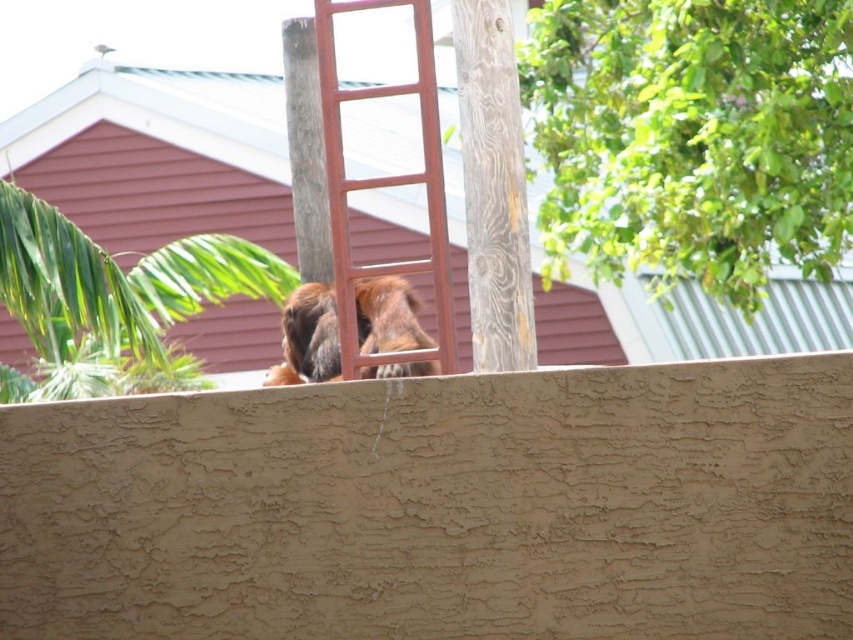
Question: Considering the real-world distances, which object is farthest from the weathered wood pole at center?

Choices:
 (A) green leafy tree at upper right
 (B) brown wooden ladder at center

Answer: (A)

Question: Can you confirm if green leafy tree at upper left is wider than brown furry dog at center?

Choices:
 (A) no
 (B) yes

Answer: (A)

Question: Can you confirm if green leafy tree at upper right is bigger than brown furry dog at center?

Choices:
 (A) yes
 (B) no

Answer: (A)

Question: Is green leafy tree at upper right to the right of brown furry dog at center from the viewer's perspective?

Choices:
 (A) yes
 (B) no

Answer: (A)

Question: Estimate the real-world distances between objects in this image. Which object is closer to the weathered wood pole at center?

Choices:
 (A) green leafy tree at upper left
 (B) green leafy tree at upper right

Answer: (A)

Question: Which point is closer to the camera?

Choices:
 (A) (312, 320)
 (B) (415, 36)

Answer: (B)